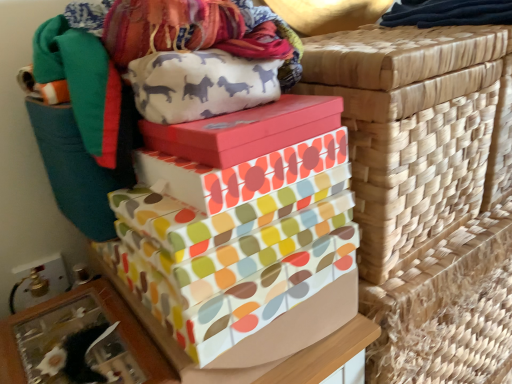
Question: Which direction should I rotate to face multicolored paper gift boxes at center, the 1th gift box from the bottom, — up or down?

Choices:
 (A) up
 (B) down

Answer: (B)

Question: Considering the relative positions of matte pink box at center, placed as the third gift box when sorted from bottom to top, and multicolored paper gift boxes at center, acting as the third gift box starting from the top, in the image provided, is matte pink box at center, placed as the third gift box when sorted from bottom to top, to the left of multicolored paper gift boxes at center, acting as the third gift box starting from the top, from the viewer's perspective?

Choices:
 (A) yes
 (B) no

Answer: (B)

Question: Would you say matte pink box at center, placed as the third gift box when sorted from bottom to top, contains multicolored paper gift boxes at center, the 1th gift box from the bottom?

Choices:
 (A) no
 (B) yes

Answer: (A)

Question: From the image's perspective, is matte pink box at center, placed as the first gift box when sorted from top to bottom, below multicolored paper gift boxes at center, the 1th gift box from the bottom?

Choices:
 (A) no
 (B) yes

Answer: (A)

Question: Can you confirm if matte pink box at center, placed as the first gift box when sorted from top to bottom, is smaller than multicolored paper gift boxes at center, acting as the third gift box starting from the top?

Choices:
 (A) no
 (B) yes

Answer: (B)

Question: Is the position of matte pink box at center, placed as the first gift box when sorted from top to bottom, more distant than that of multicolored paper gift boxes at center, acting as the third gift box starting from the top?

Choices:
 (A) no
 (B) yes

Answer: (B)

Question: Does matte pink box at center, placed as the third gift box when sorted from bottom to top, appear on the right side of multicolored paper gift boxes at center, acting as the third gift box starting from the top?

Choices:
 (A) no
 (B) yes

Answer: (B)

Question: Does multicolored paper gift boxes at center, the 1th gift box from the bottom, come in front of matte pink box at center, placed as the third gift box when sorted from bottom to top?

Choices:
 (A) yes
 (B) no

Answer: (A)

Question: Does multicolored paper gift boxes at center, the 1th gift box from the bottom, turn towards matte pink box at center, placed as the third gift box when sorted from bottom to top?

Choices:
 (A) no
 (B) yes

Answer: (A)

Question: Is multicolored paper gift boxes at center, acting as the third gift box starting from the top, positioned with its back to matte pink box at center, placed as the third gift box when sorted from bottom to top?

Choices:
 (A) yes
 (B) no

Answer: (B)

Question: Does multicolored paper gift boxes at center, the 1th gift box from the bottom, have a larger size compared to matte pink box at center, placed as the third gift box when sorted from bottom to top?

Choices:
 (A) no
 (B) yes

Answer: (B)

Question: Would you say multicolored paper gift boxes at center, the 1th gift box from the bottom, is outside matte pink box at center, placed as the third gift box when sorted from bottom to top?

Choices:
 (A) no
 (B) yes

Answer: (B)

Question: Considering the relative positions of multicolored paper gift boxes at center, the 1th gift box from the bottom, and matte pink box at center, placed as the third gift box when sorted from bottom to top, in the image provided, is multicolored paper gift boxes at center, the 1th gift box from the bottom, to the right of matte pink box at center, placed as the third gift box when sorted from bottom to top, from the viewer's perspective?

Choices:
 (A) yes
 (B) no

Answer: (B)

Question: From the image's perspective, is matte pink box at center, placed as the third gift box when sorted from bottom to top, located beneath multicolored fabric gift box at center, the second gift box from the bottom?

Choices:
 (A) no
 (B) yes

Answer: (A)